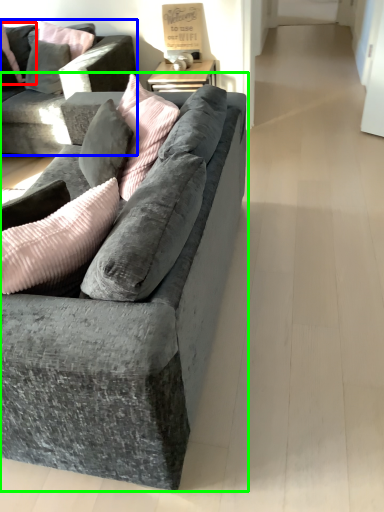
Question: Considering the real-world distances, which object is closest to pillow (highlighted by a red box)? studio couch (highlighted by a blue box) or studio couch (highlighted by a green box).

Choices:
 (A) studio couch
 (B) studio couch

Answer: (A)